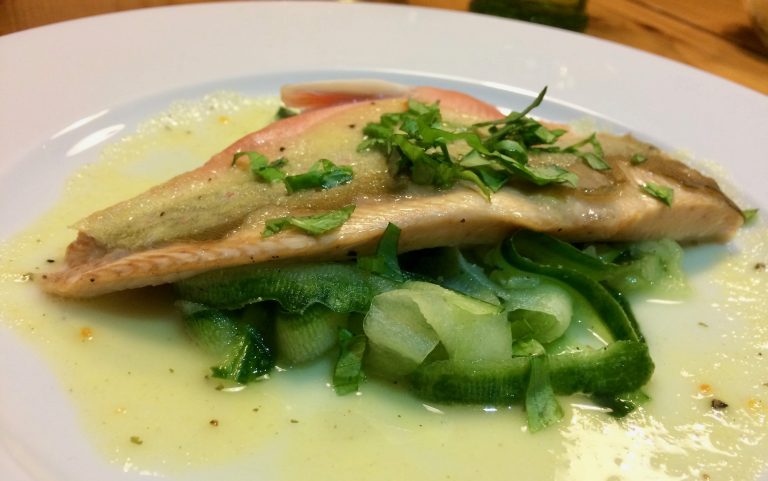
You are a GUI agent. You are given a task and a screenshot of the screen. Output one action in this format:
    pyautogui.click(x=<x>, y=<y>)
    Task: Click on the table
    The image size is (768, 481).
    Given the screenshot: What is the action you would take?
    pyautogui.click(x=664, y=35)